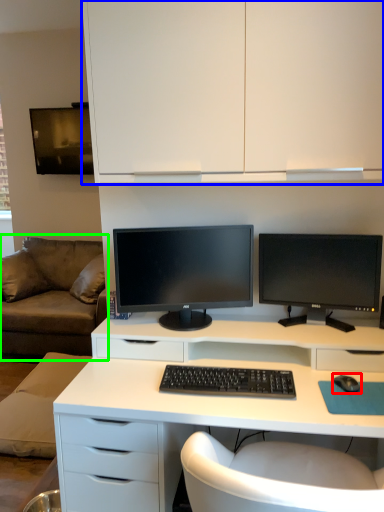
Question: Which object is positioned farthest from mouse (highlighted by a red box)? Select from cabinetry (highlighted by a blue box) and studio couch (highlighted by a green box).

Choices:
 (A) cabinetry
 (B) studio couch

Answer: (B)